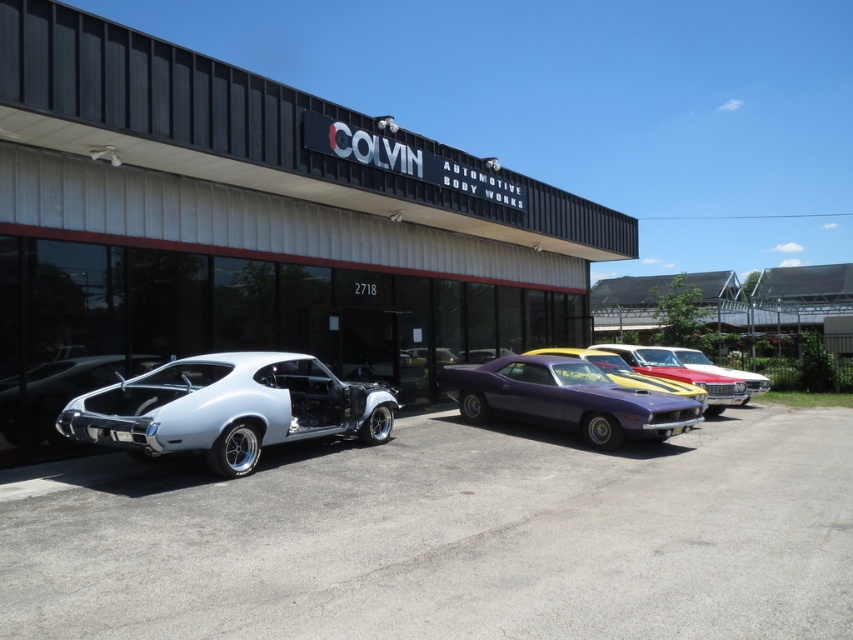
Does chrome metallic car at center have a smaller size compared to shiny red car at center?

Yes.

Between chrome metallic car at center and shiny red car at center, which one appears on the left side from the viewer's perspective?

chrome metallic car at center

This screenshot has width=853, height=640. What do you see at coordinates (57, 392) in the screenshot?
I see `chrome metallic car at center` at bounding box center [57, 392].

Locate an element on the screen. The height and width of the screenshot is (640, 853). chrome metallic car at center is located at coordinates (57, 392).

Can you confirm if white metallic sports car at center is positioned below shiny metallic car at center?

Correct, white metallic sports car at center is located below shiny metallic car at center.

Between white metallic sports car at center and shiny metallic car at center, which one has less height?

white metallic sports car at center

Where is `white metallic sports car at center`? This screenshot has height=640, width=853. white metallic sports car at center is located at coordinates (228, 408).

Is purple glossy muscle car at center positioned at the back of shiny red car at center?

No, purple glossy muscle car at center is in front of shiny red car at center.

Is point (606, 397) less distant than point (761, 388)?

Yes.

Locate an element on the screen. purple glossy muscle car at center is located at coordinates (567, 397).